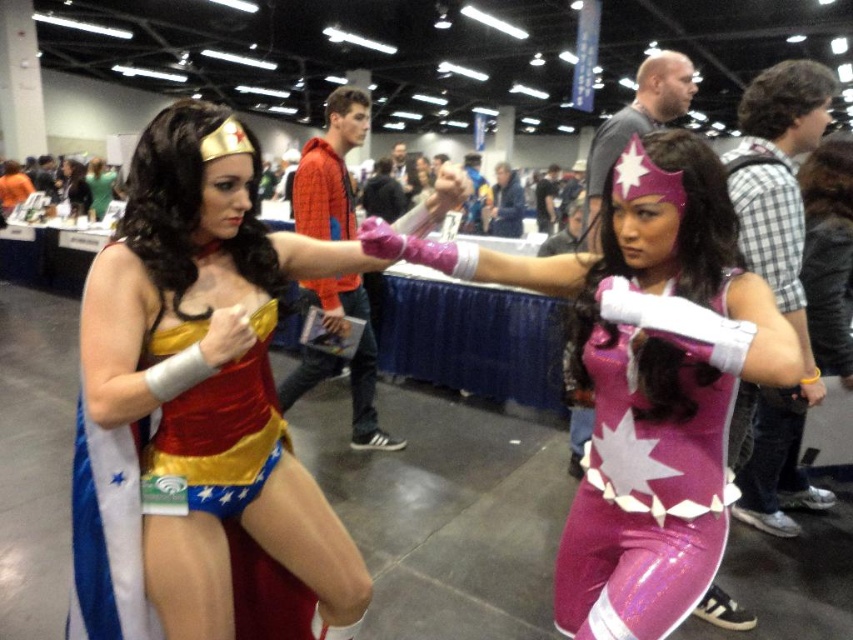
Question: Which object is the farthest from the matte gold headband at center?

Choices:
 (A) purple glossy costume at center
 (B) shiny satin costume at center
 (C) purple glossy bodysuit at center

Answer: (C)

Question: Does purple glossy bodysuit at center have a larger size compared to matte gold headband at center?

Choices:
 (A) yes
 (B) no

Answer: (B)

Question: Which point is closer to the camera taking this photo?

Choices:
 (A) (567, 285)
 (B) (381, 262)
 (C) (724, 528)

Answer: (C)

Question: Which is nearer to the shiny satin costume at center?

Choices:
 (A) matte gold headband at center
 (B) purple glossy bodysuit at center

Answer: (B)

Question: Can you confirm if shiny satin costume at center is positioned to the left of purple glossy costume at center?

Choices:
 (A) no
 (B) yes

Answer: (B)

Question: Does purple glossy costume at center have a larger size compared to matte gold headband at center?

Choices:
 (A) no
 (B) yes

Answer: (A)